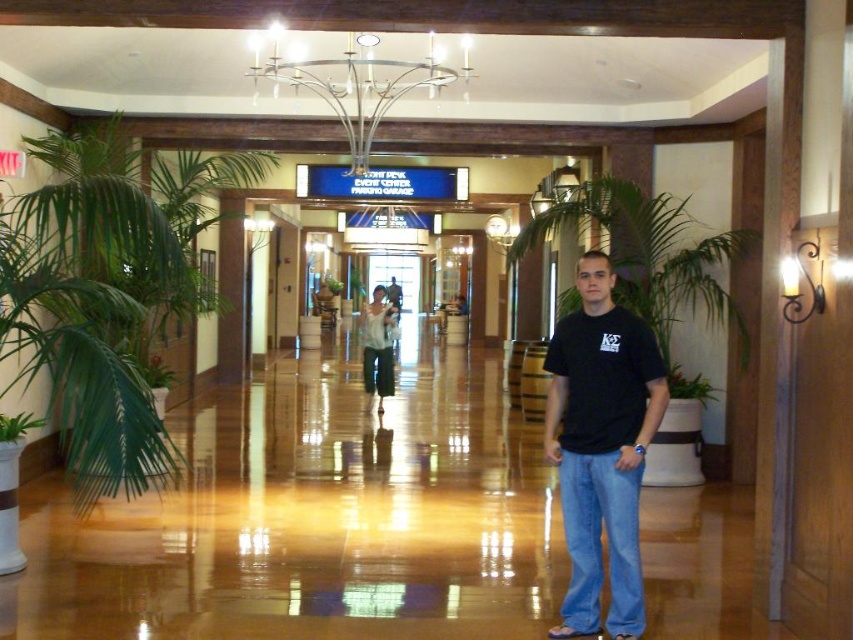
You are standing in the hallway and want to take a photo of the white cotton shirt at center. The camera you have is 10 meters in range. Can you take the photo from where you are?

The white cotton shirt at center and camera are 11.06 meters apart from each other. Since the camera has a 10 meter range, you cannot take the photo from your current position.

You are standing in the hallway and see a point marked at coordinates (378, 346). What object is located at that point?

The white cotton shirt at center is located at the point marked at coordinates (378, 346).

You are standing at the point marked as point [16,426] in the hallway. What object is located at that point?

The point [16,426] is where the green leafy plant at lower left is placed.